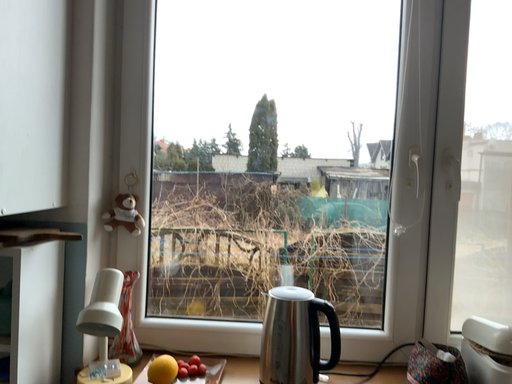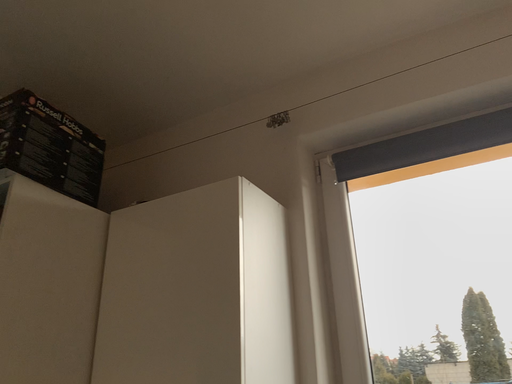
Question: Which way did the camera rotate in the video?

Choices:
 (A) rotated right
 (B) rotated left

Answer: (B)